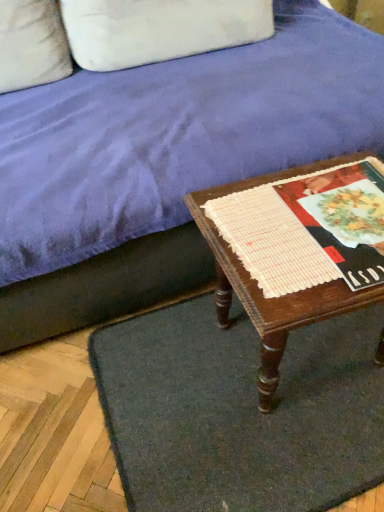
Locate an element on the screen. The width and height of the screenshot is (384, 512). blank space situated above dark gray carpet at lower center (from a real-world perspective) is located at coordinates (237, 394).